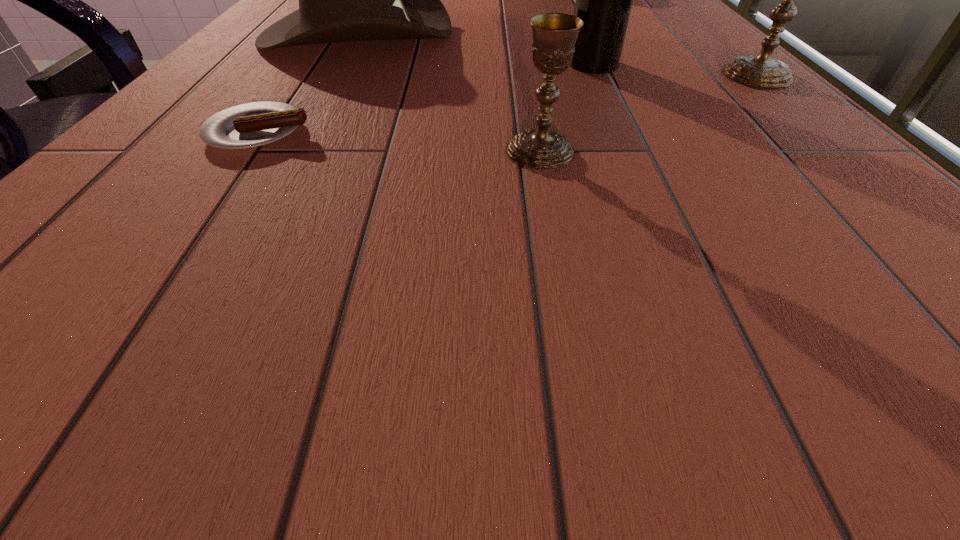
All chalices are currently evenly spaced. To continue this pattern, where would you add another chalice on the left? Please point out a vacant spot. Please provide its 2D coordinates. Your answer should be formatted as a tuple, i.e. [(x, y)], where the tuple contains the x and y coordinates of a point satisfying the conditions above.

[(139, 289)]